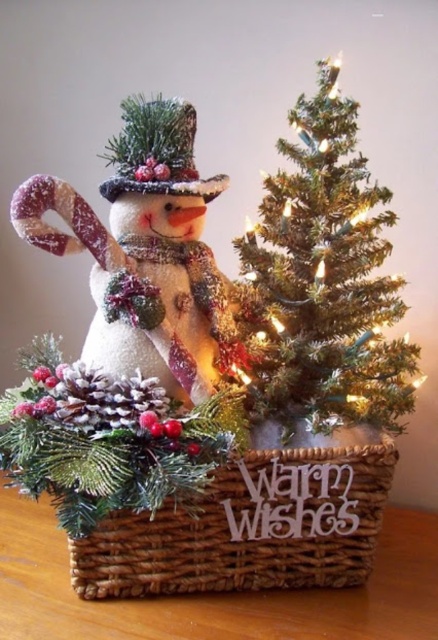
Question: Which point is farther from the camera taking this photo?

Choices:
 (A) (304, 300)
 (B) (20, 209)
 (C) (357, 451)

Answer: (A)

Question: Based on their relative distances, which object is nearer to the woven brown basket at center?

Choices:
 (A) frosted fabric snowman at center
 (B) green textured christmas tree at center

Answer: (B)

Question: Can you confirm if frosted fabric snowman at center is positioned to the left of woven brown basket at center?

Choices:
 (A) yes
 (B) no

Answer: (A)

Question: Based on their relative distances, which object is nearer to the green textured christmas tree at center?

Choices:
 (A) frosted fabric snowman at center
 (B) woven brown basket at center

Answer: (A)

Question: Can you confirm if green textured christmas tree at center is positioned below woven brown basket at center?

Choices:
 (A) no
 (B) yes

Answer: (A)

Question: Can you confirm if green textured christmas tree at center is positioned to the left of frosted fabric snowman at center?

Choices:
 (A) no
 (B) yes

Answer: (A)